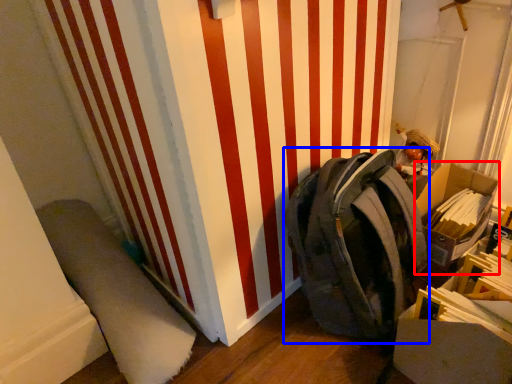
Question: Which point is further to the camera, cardboard box (highlighted by a red box) or backpack (highlighted by a blue box)?

Choices:
 (A) cardboard box
 (B) backpack

Answer: (A)